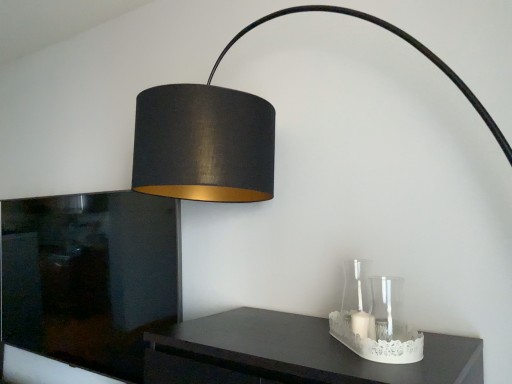
Question: Is clear glass candle holder at lower right, which appears as the 1th glass vase when viewed from the back, bigger or smaller than transparent glass vase at lower right, acting as the first glass vase starting from the front?

Choices:
 (A) big
 (B) small

Answer: (A)

Question: Considering their positions, is clear glass candle holder at lower right, which appears as the 1th glass vase when viewed from the back, located in front of or behind transparent glass vase at lower right, acting as the first glass vase starting from the front?

Choices:
 (A) front
 (B) behind

Answer: (B)

Question: From the image's perspective, relative to transparent glass vase at lower right, which is the second glass vase from back to front, is clear glass candle holder at lower right, which is the second glass vase in front-to-back order, above or below?

Choices:
 (A) above
 (B) below

Answer: (B)

Question: From their relative heights in the image, would you say transparent glass vase at lower right, which is the second glass vase from back to front, is taller or shorter than clear glass candle holder at lower right, which is the second glass vase in front-to-back order?

Choices:
 (A) short
 (B) tall

Answer: (A)

Question: Is point (372, 307) positioned closer to the camera than point (366, 271)?

Choices:
 (A) closer
 (B) farther

Answer: (A)

Question: In terms of width, does transparent glass vase at lower right, acting as the first glass vase starting from the front, look wider or thinner when compared to clear glass candle holder at lower right, which is the second glass vase in front-to-back order?

Choices:
 (A) wide
 (B) thin

Answer: (B)

Question: Considering their positions, is transparent glass vase at lower right, acting as the first glass vase starting from the front, located in front of or behind clear glass candle holder at lower right, which appears as the 1th glass vase when viewed from the back?

Choices:
 (A) behind
 (B) front

Answer: (B)